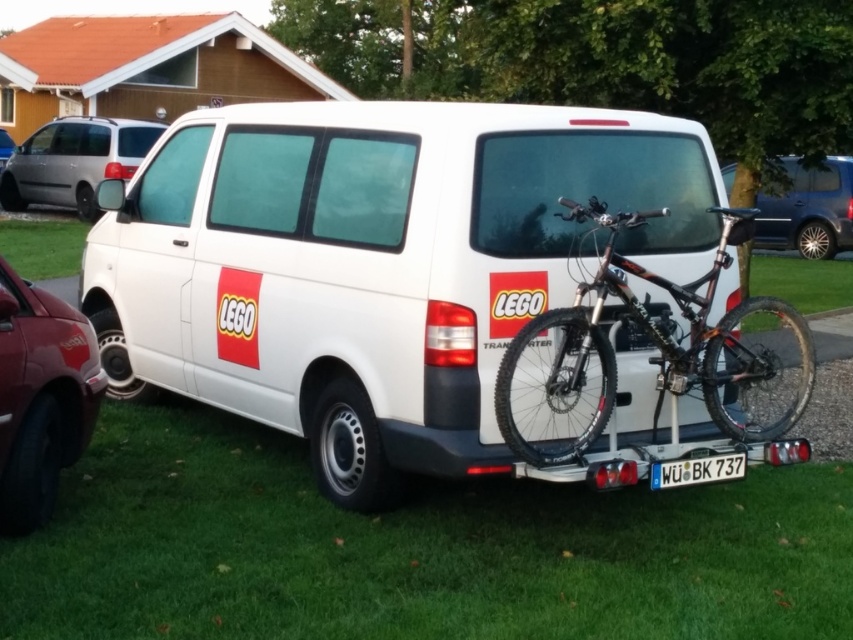
Does metallic blue minivan at upper right lie in front of white plastic license plate at lower center?

No.

Between point (849, 156) and point (701, 483), which one is positioned behind?

The point (849, 156) is more distant.

In order to click on metallic blue minivan at upper right in this screenshot , I will do `click(808, 211)`.

Where is `satin silver van at upper left`? The width and height of the screenshot is (853, 640). satin silver van at upper left is located at coordinates (74, 161).

Between satin silver van at upper left and metallic silver car at upper left, which one has less height?

Standing shorter between the two is metallic silver car at upper left.

Is point (57, 138) farther from viewer compared to point (3, 163)?

That is False.

The width and height of the screenshot is (853, 640). What are the coordinates of `satin silver van at upper left` in the screenshot? It's located at (74, 161).

Consider the image. Measure the distance from shiny red car at lower left to satin silver van at upper left.

They are 12.57 meters apart.

Is point (48, 352) positioned after point (3, 173)?

No, (48, 352) is in front of (3, 173).

Who is more distant from viewer, (62, 305) or (61, 124)?

The point (61, 124) is more distant.

At what (x,y) coordinates should I click in order to perform the action: click on shiny red car at lower left. Please return your answer as a coordinate pair (x, y). Looking at the image, I should click on (41, 397).